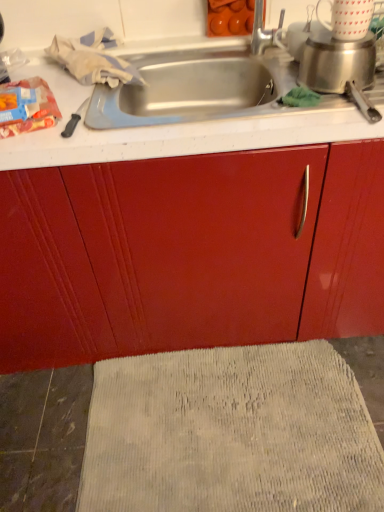
The image size is (384, 512). In order to click on free space above beige textured bath mat at lower center (from a real-world perspective) in this screenshot , I will do `click(223, 429)`.